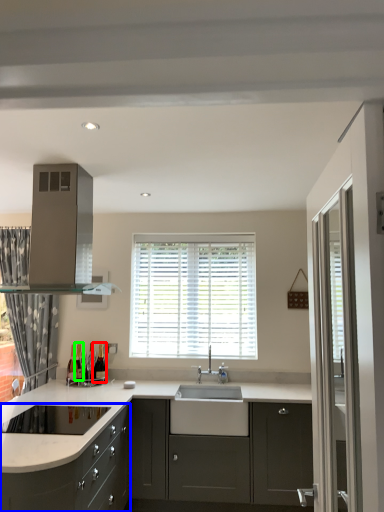
Question: Which is nearer to the wine bottle (highlighted by a red box)? cabinetry (highlighted by a blue box) or wine bottle (highlighted by a green box).

Choices:
 (A) cabinetry
 (B) wine bottle

Answer: (B)